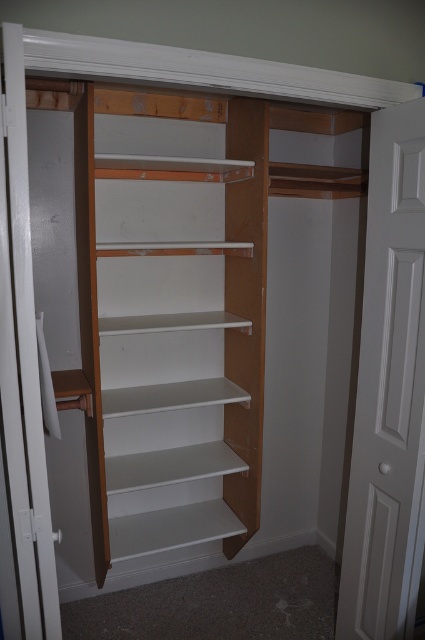
You are standing in front of the closet and want to open the white painted wood door at right. Based on its position, where should you reach to open it?

The white painted wood door at right is located at point 0.614 on the x axis and 0.915 on the y axis, so you should reach towards the lower right corner of the closet to open it.